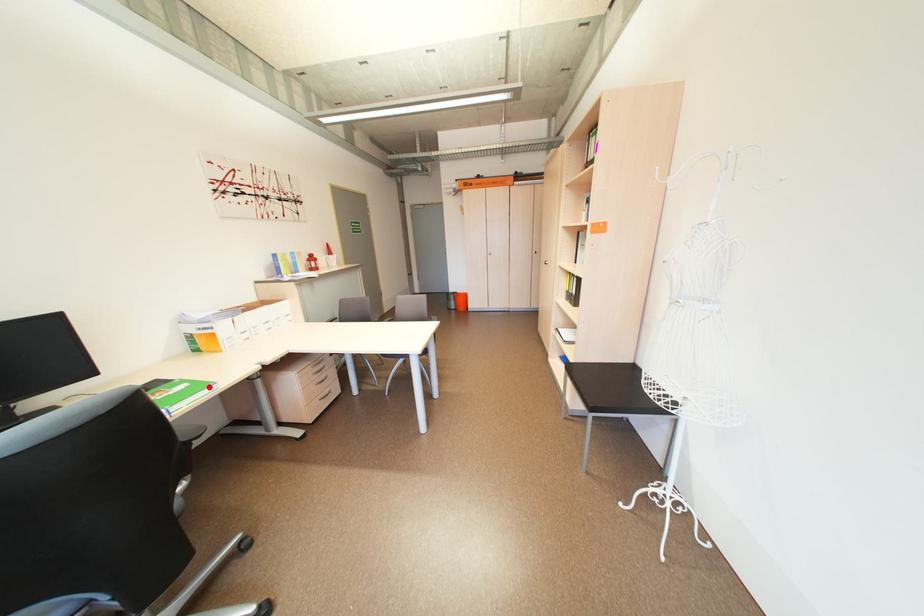
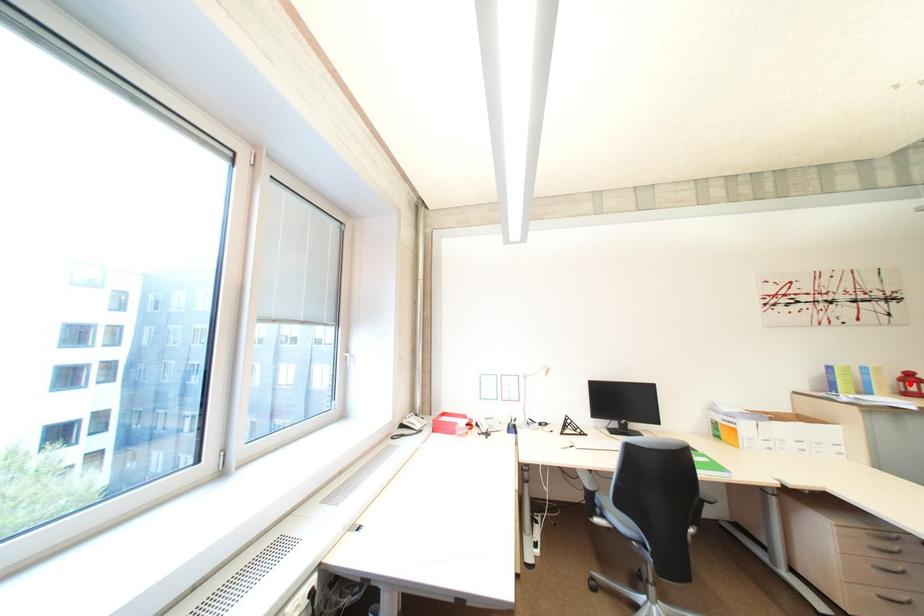
I am providing you with two images of the same scene from different viewpoints. A red point is marked on the first image and another point is marked on the second image. Are the points marked in image1 and image2 representing the same 3D position?

No